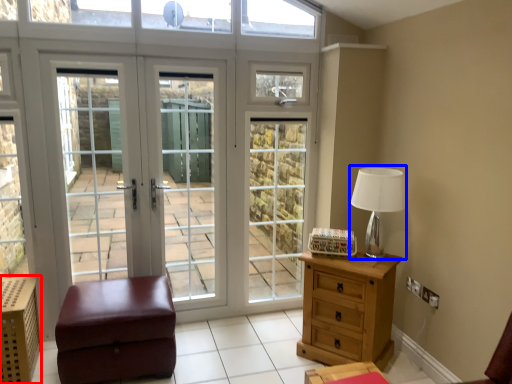
Question: Which object appears closest to the camera in this image, crate (highlighted by a red box) or table lamp (highlighted by a blue box)?

Choices:
 (A) crate
 (B) table lamp

Answer: (A)